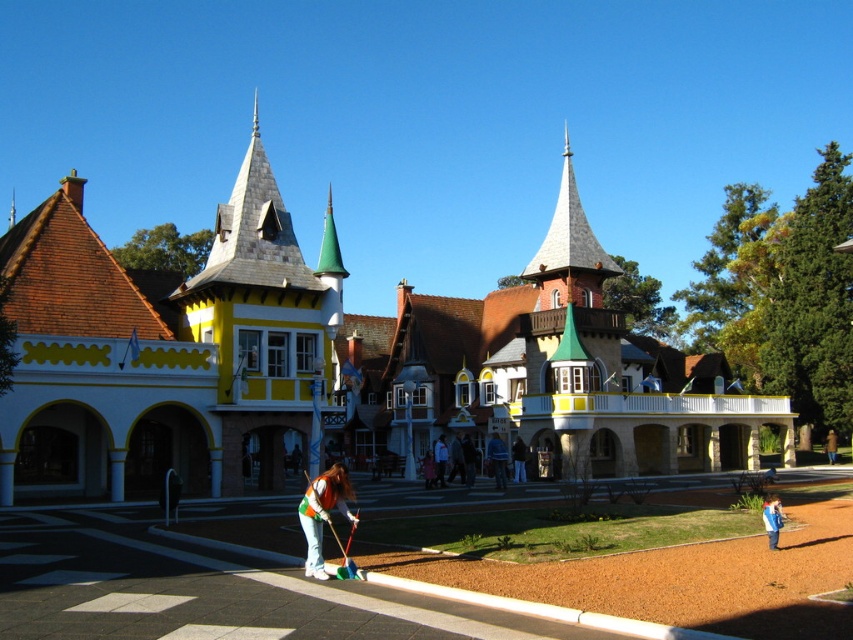
Question: Is green fabric shirt at center wider than green fabric jacket at center?

Choices:
 (A) yes
 (B) no

Answer: (A)

Question: Is green fabric shirt at center further to camera compared to blue fabric jacket at lower right?

Choices:
 (A) yes
 (B) no

Answer: (B)

Question: Which object is farther from the camera taking this photo?

Choices:
 (A) green fabric jacket at center
 (B) green fabric shirt at center

Answer: (A)

Question: Estimate the real-world distances between objects in this image. Which object is closer to the blue fabric jacket at lower right?

Choices:
 (A) green fabric shirt at center
 (B) green fabric jacket at center

Answer: (A)

Question: Can you confirm if green fabric shirt at center is bigger than green fabric jacket at center?

Choices:
 (A) no
 (B) yes

Answer: (B)

Question: Which point is farther to the camera?

Choices:
 (A) (769, 518)
 (B) (309, 538)
 (C) (494, 436)

Answer: (C)